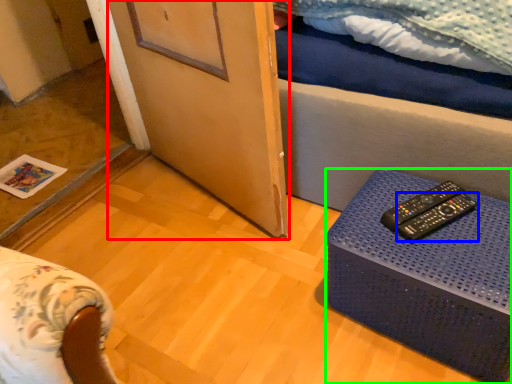
Question: Which is farther away from screen door (highlighted by a red box)? remote control (highlighted by a blue box) or table (highlighted by a green box)?

Choices:
 (A) remote control
 (B) table

Answer: (A)